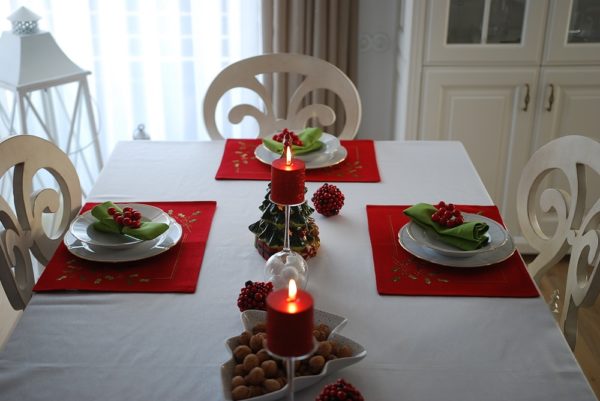
In order to click on dish in this screenshot , I will do `click(156, 251)`, `click(109, 243)`, `click(329, 165)`, `click(326, 148)`, `click(442, 264)`, `click(437, 250)`.